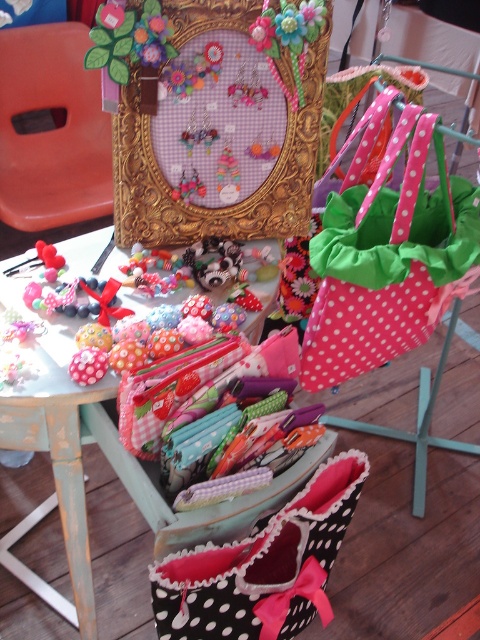
Is pink polka dot fabric bag at center thinner than black polka dot fabric gift bag at center?

In fact, pink polka dot fabric bag at center might be wider than black polka dot fabric gift bag at center.

Can you confirm if pink polka dot fabric bag at center is positioned to the right of black polka dot fabric gift bag at center?

Correct, you'll find pink polka dot fabric bag at center to the right of black polka dot fabric gift bag at center.

At what (x,y) coordinates should I click in order to perform the action: click on pink polka dot fabric bag at center. Please return your answer as a coordinate pair (x, y). This screenshot has width=480, height=640. Looking at the image, I should click on (388, 256).

Is wooden table at center shorter than smooth orange chair at upper left?

In fact, wooden table at center may be taller than smooth orange chair at upper left.

Which is in front, point (103, 548) or point (80, 157)?

Positioned in front is point (103, 548).

Find the location of `wooden table at center`. wooden table at center is located at coordinates (86, 554).

Which is above, wooden table at center or pink polka dot fabric bag at center?

pink polka dot fabric bag at center is above.

Find the location of a particular element. Image resolution: width=480 pixels, height=640 pixels. wooden table at center is located at coordinates (86, 554).

The image size is (480, 640). What are the coordinates of `wooden table at center` in the screenshot? It's located at (86, 554).